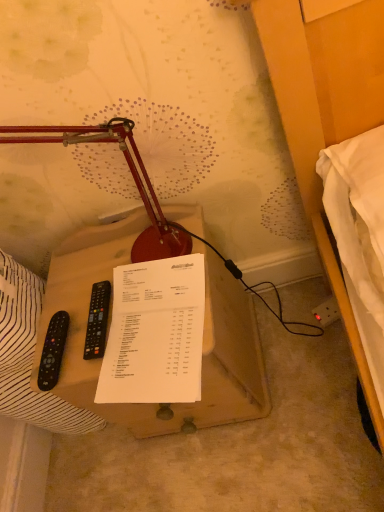
The image size is (384, 512). I want to click on vacant area that is in front of white paper at left, so click(x=132, y=479).